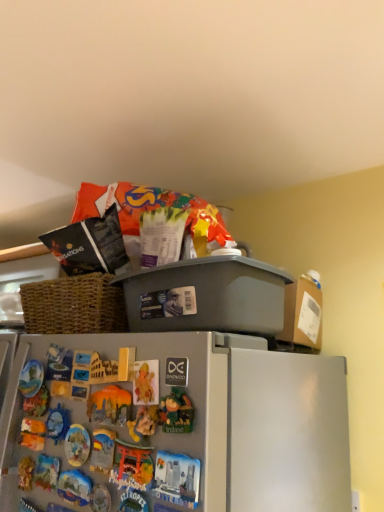
Question: Is gray plastic bin at upper center to the left or to the right of matte plastic toy at center in the image?

Choices:
 (A) left
 (B) right

Answer: (B)

Question: Looking at the image, does gray plastic bin at upper center seem bigger or smaller compared to matte plastic toy at center?

Choices:
 (A) big
 (B) small

Answer: (A)

Question: Is point (241, 310) closer or farther from the camera than point (112, 387)?

Choices:
 (A) closer
 (B) farther

Answer: (B)

Question: Considering the positions of matte plastic toy at center and gray plastic bin at upper center in the image, is matte plastic toy at center wider or thinner than gray plastic bin at upper center?

Choices:
 (A) thin
 (B) wide

Answer: (A)

Question: Is matte plastic toy at center bigger or smaller than gray plastic bin at upper center?

Choices:
 (A) big
 (B) small

Answer: (B)

Question: In the image, is matte plastic toy at center on the left side or the right side of gray plastic bin at upper center?

Choices:
 (A) right
 (B) left

Answer: (B)

Question: In terms of height, does matte plastic toy at center look taller or shorter compared to gray plastic bin at upper center?

Choices:
 (A) short
 (B) tall

Answer: (A)